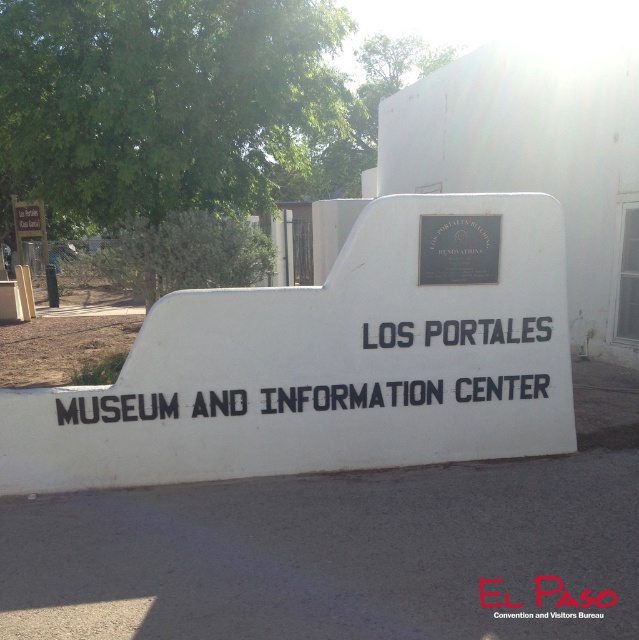
Is white matte sign at center taller than metallic plaque at center?

Correct, white matte sign at center is much taller as metallic plaque at center.

Between white matte sign at center and metallic plaque at center, which one appears on the right side from the viewer's perspective?

From the viewer's perspective, metallic plaque at center appears more on the right side.

Who is more forward, [539,257] or [463,218]?

Point [463,218]

You are a GUI agent. You are given a task and a screenshot of the screen. Output one action in this format:
    pyautogui.click(x=<x>, y=<y>)
    Task: Click on the white matte sign at center
    The image size is (639, 640).
    Given the screenshot: What is the action you would take?
    pyautogui.click(x=325, y=369)

Is point (298, 403) positioned behind point (447, 241)?

No, (298, 403) is closer to viewer.

Between point (534, 385) and point (472, 248), which one is positioned in front?

Point (472, 248) is more forward.

Identify the location of blackmaterial/texturesign at center. The height and width of the screenshot is (640, 639). (348, 394).

Is white matte sign at center wider than blackmaterial/texturesign at center?

Indeed, white matte sign at center has a greater width compared to blackmaterial/texturesign at center.

Between white matte sign at center and blackmaterial/texturesign at center, which one is positioned lower?

blackmaterial/texturesign at center is lower down.

Image resolution: width=639 pixels, height=640 pixels. Identify the location of white matte sign at center. (325, 369).